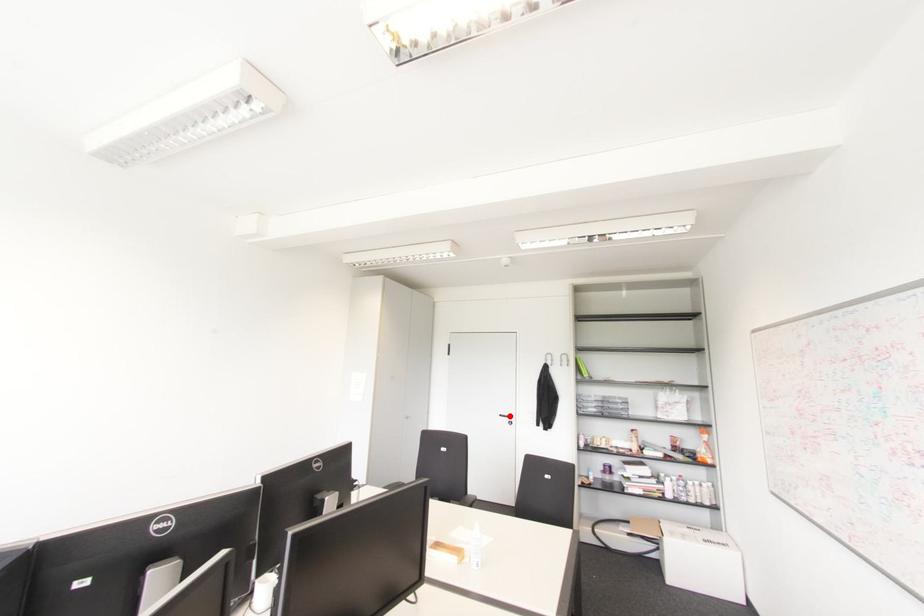
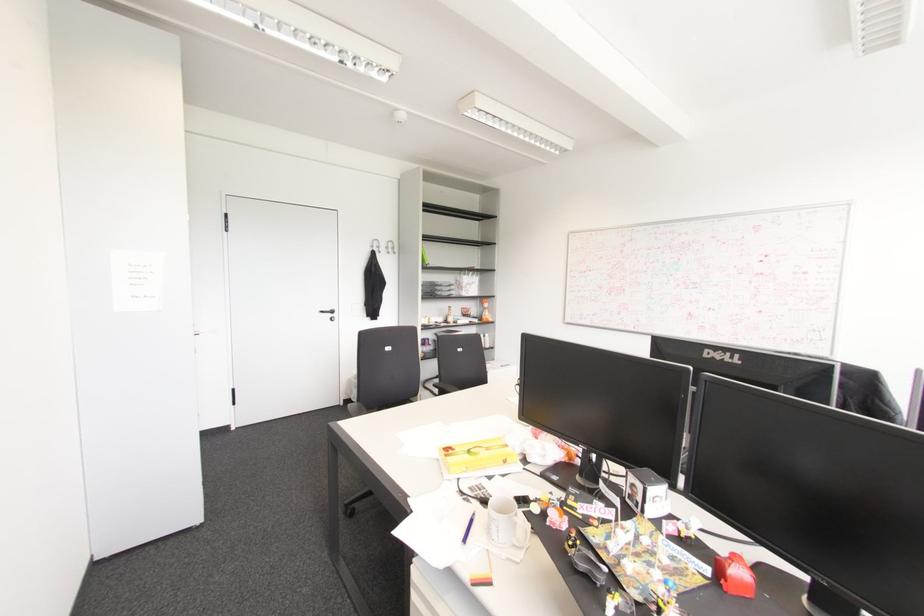
Where in the second image is the point corresponding to the highlighted location from the first image?

(332, 310)